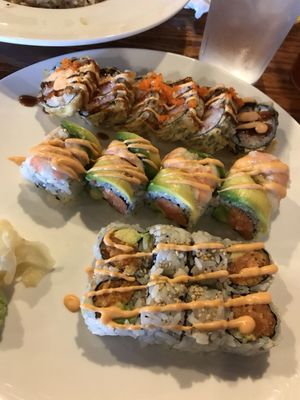
Find the location of a particular element. This screenshot has width=300, height=400. white dinner plate is located at coordinates (85, 25), (74, 244).